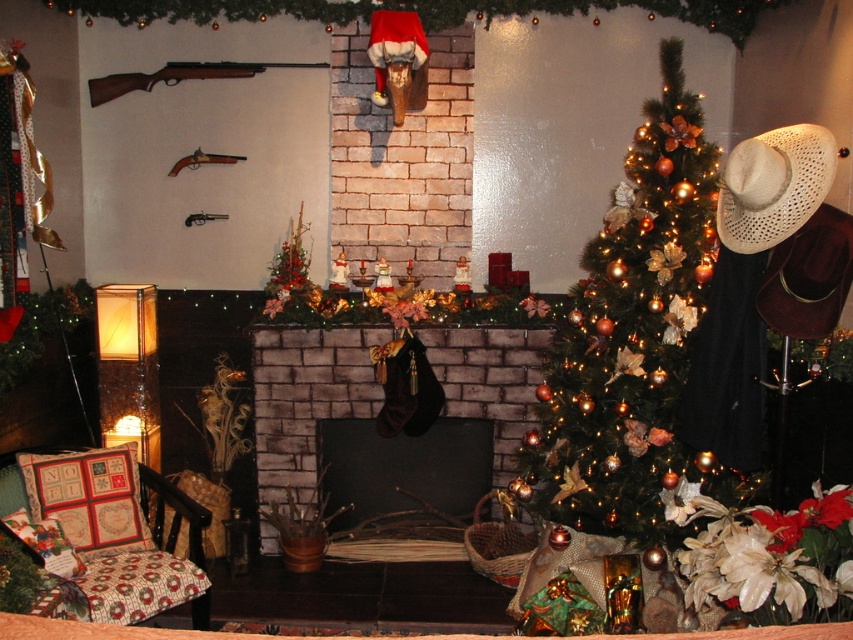
Can you confirm if brick fireplace at center is positioned below beige woven cowboy hat at right?

Yes.

Which is in front, point (515, 426) or point (718, 216)?

Positioned in front is point (718, 216).

Identify the location of brick fireplace at center. This screenshot has width=853, height=640. (306, 397).

Can you confirm if green matte christmas tree at center is positioned to the left of beige woven cowboy hat at right?

Indeed, green matte christmas tree at center is positioned on the left side of beige woven cowboy hat at right.

Is green matte christmas tree at center shorter than beige woven cowboy hat at right?

No.

Does point (672, 387) come behind point (828, 168)?

Yes, point (672, 387) is behind point (828, 168).

Identify the location of green matte christmas tree at center. Image resolution: width=853 pixels, height=640 pixels. (633, 339).

Which is in front, point (612, 321) or point (254, 385)?

Point (612, 321) is in front.

Does point (624, 454) come in front of point (254, 380)?

Yes, point (624, 454) is closer to viewer.

Locate an element on the screen. green matte christmas tree at center is located at coordinates (633, 339).